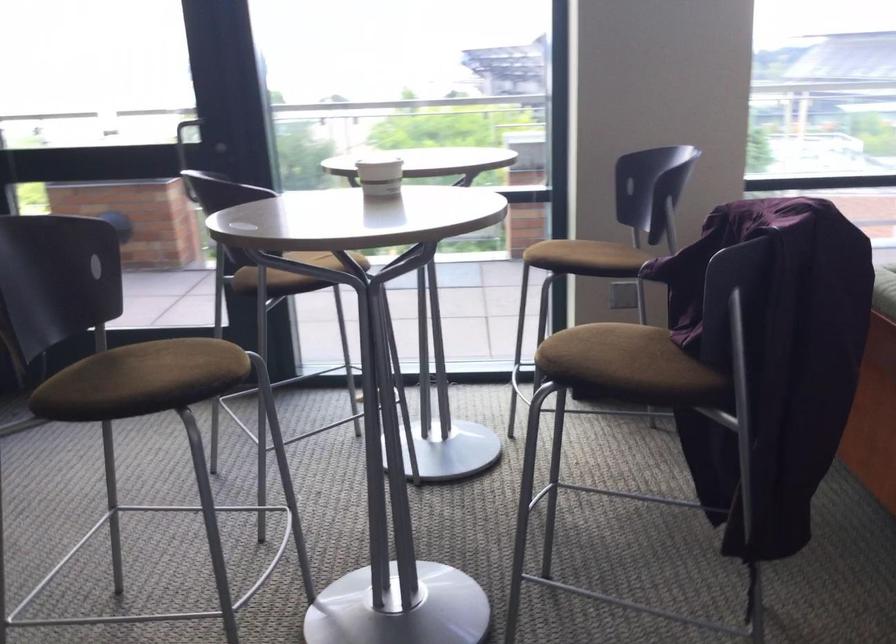
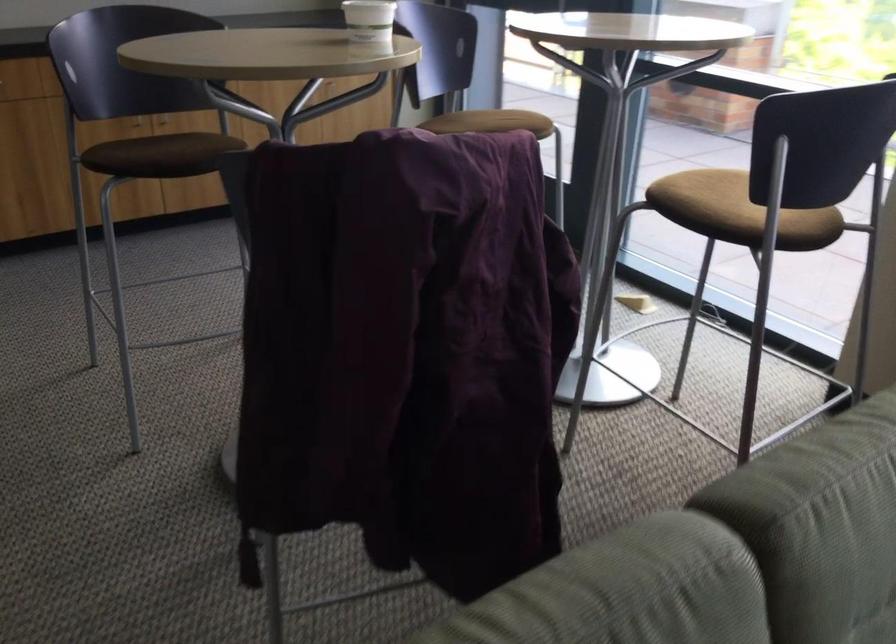
The point at (392,173) is marked in the first image. Where is the corresponding point in the second image?

(368, 20)